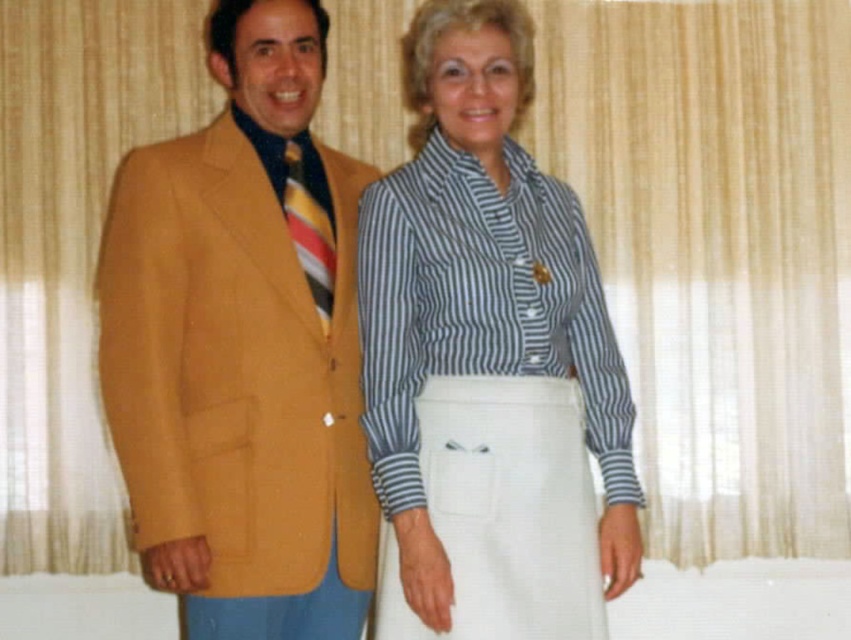
Question: Where is matte gold blazer at left located in relation to striped cotton shirt at center in the image?

Choices:
 (A) left
 (B) right

Answer: (A)

Question: Does matte gold blazer at left appear on the left side of striped cotton shirt at center?

Choices:
 (A) yes
 (B) no

Answer: (A)

Question: Can you confirm if matte gold blazer at left is thinner than striped cotton shirt at center?

Choices:
 (A) yes
 (B) no

Answer: (A)